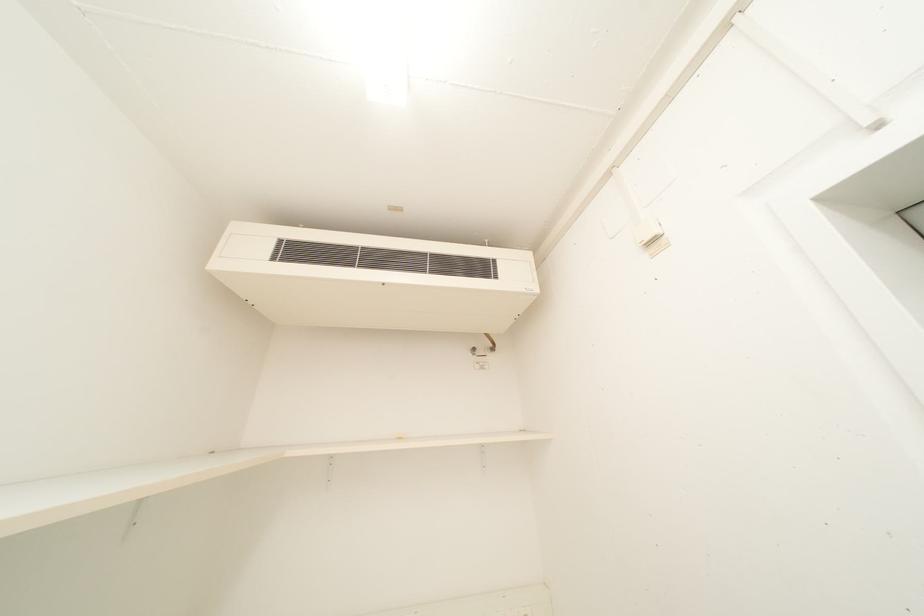
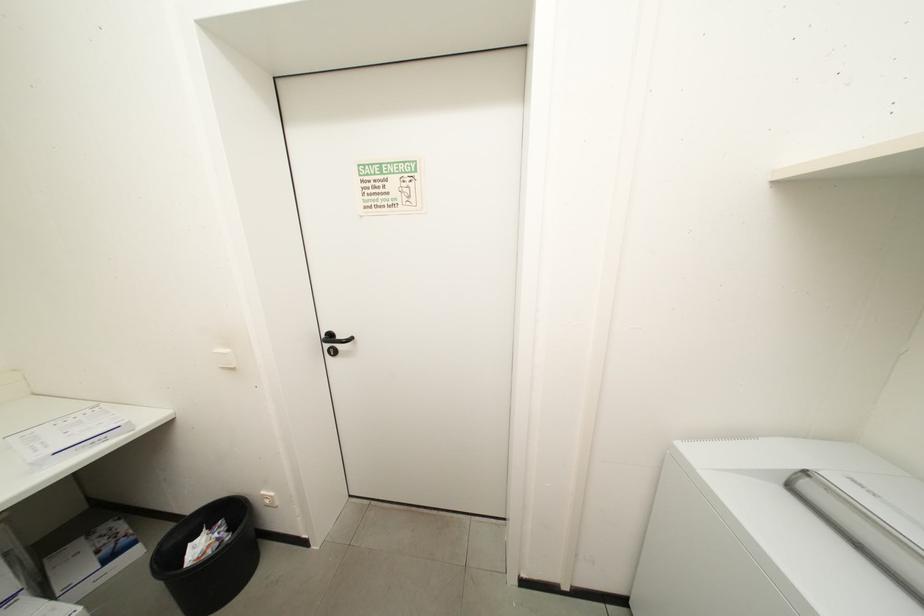
The first image is from the beginning of the video and the second image is from the end. How did the camera likely rotate when shooting the video?

The camera rotated toward right-down.